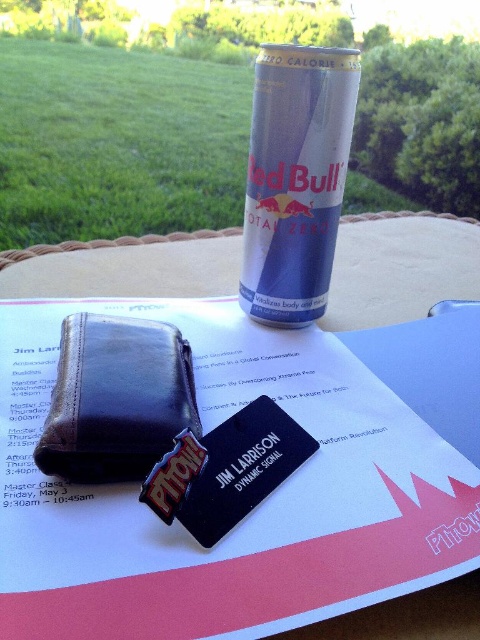
Question: Which point appears farthest from the camera in this image?

Choices:
 (A) 288,80
 (B) 382,612

Answer: (A)

Question: Which point is farther to the camera?

Choices:
 (A) (314, 232)
 (B) (100, 276)

Answer: (B)

Question: Is brown leather wallet at upper left further to the viewer compared to blue metallic red bull can at upper center?

Choices:
 (A) yes
 (B) no

Answer: (A)

Question: Is brown leather wallet at upper left above blue metallic red bull can at upper center?

Choices:
 (A) no
 (B) yes

Answer: (A)

Question: Can you confirm if brown leather wallet at upper left is positioned below blue metallic red bull can at upper center?

Choices:
 (A) yes
 (B) no

Answer: (A)